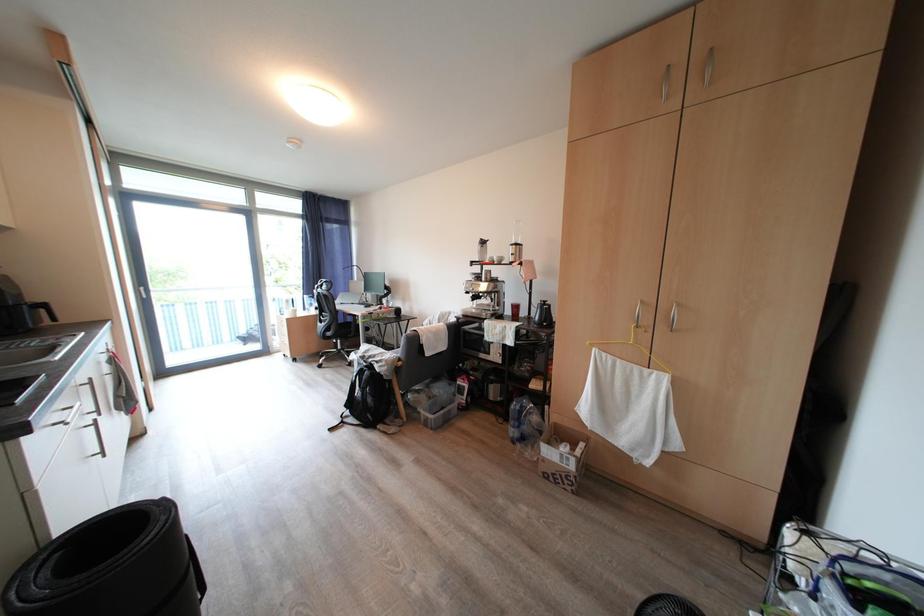
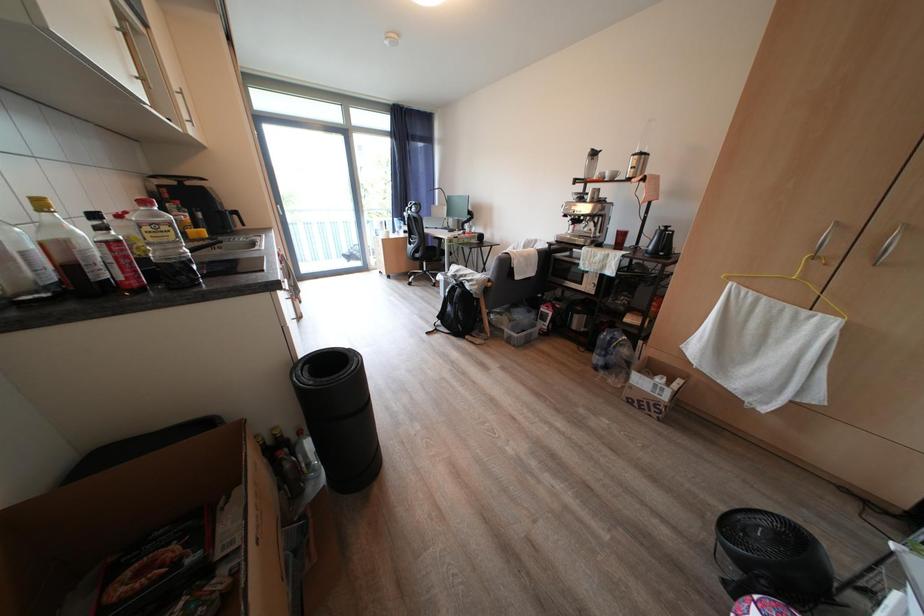
Question: Based on the continuous images, in which direction is the camera rotating? Reply with the corresponding letter.

Choices:
 (A) Left
 (B) Right
 (C) Up
 (D) Down

Answer: (D)